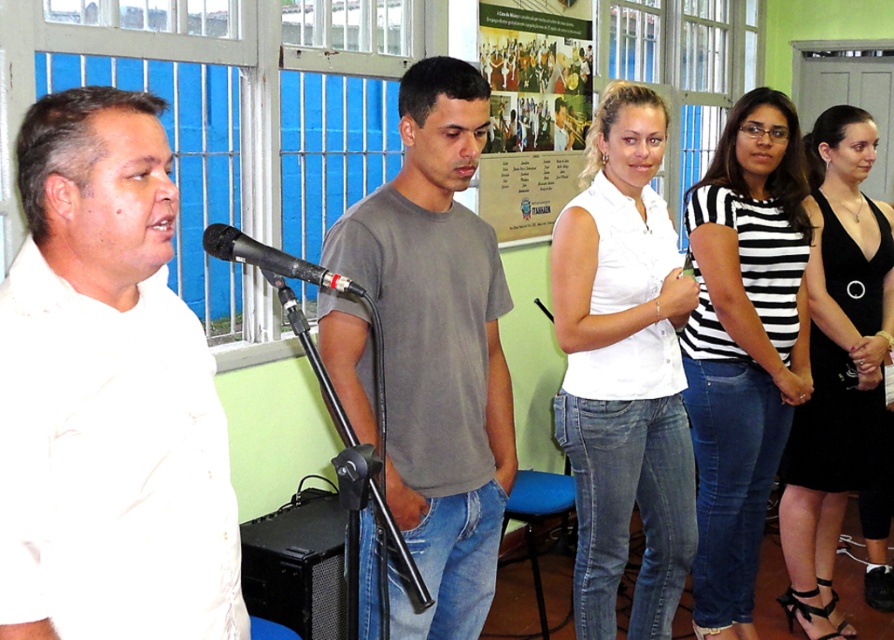
Based on the photo, can you confirm if black satin dress at right is smaller than matte paper poster at center?

Actually, black satin dress at right might be larger than matte paper poster at center.

In the scene shown: Does black satin dress at right have a lesser height compared to matte paper poster at center?

In fact, black satin dress at right may be taller than matte paper poster at center.

Locate an element on the screen. black satin dress at right is located at coordinates (836, 362).

Is gray matte t-shirt at center positioned before black satin dress at right?

Yes, it is in front of black satin dress at right.

From the picture: Is gray matte t-shirt at center bigger than black satin dress at right?

Actually, gray matte t-shirt at center might be smaller than black satin dress at right.

Describe the element at coordinates (437, 348) in the screenshot. The width and height of the screenshot is (894, 640). I see `gray matte t-shirt at center` at that location.

The image size is (894, 640). Find the location of `gray matte t-shirt at center`. gray matte t-shirt at center is located at coordinates (437, 348).

Does white cotton shirt at center have a larger size compared to black matte microphone at center?

Yes, white cotton shirt at center is bigger than black matte microphone at center.

Between point (660, 497) and point (229, 240), which one is positioned in front?

Positioned in front is point (229, 240).

I want to click on white cotton shirt at center, so click(x=623, y=371).